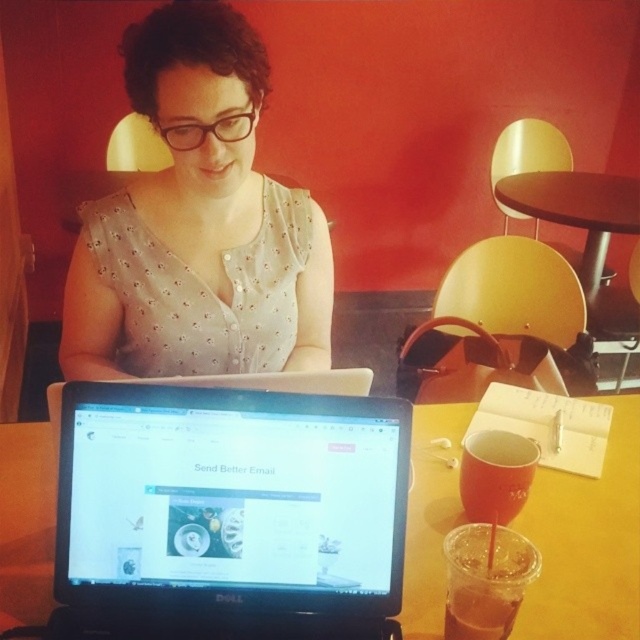
You are a fashion designer observing the scene. You need to determine which item is bigger between the matte white blouse at center and the translucent plastic cup at lower center. Which one is bigger?

The matte white blouse at center is larger in size than the translucent plastic cup at lower center.

You are a barista in a cafe and need to place a new drink order on the table. The customer specified that the drink must be placed exactly 24 inches away from their current item on the table. You see the matte white blouse at center and the translucent plastic cup at lower center. Can you place the new drink order between them?

The distance between the matte white blouse at center and the translucent plastic cup at lower center is 23.66 inches. Since the required distance is 24 inches, placing the new drink order between them would not meet the customer requirement as the space is slightly less than needed.

You have a Dell laptop and a red cup on a table. You want to place a phone charger between them so that it doesn t fall off the table. The charger is 3 inches long. Is there enough space between the black matte laptop at lower center and the translucent plastic cup at lower center to fit the charger?

The distance between the black matte laptop at lower center and the translucent plastic cup at lower center is 9.79 inches. Since the charger is only 3 inches long, there is sufficient space to place it between them without it falling off the table.